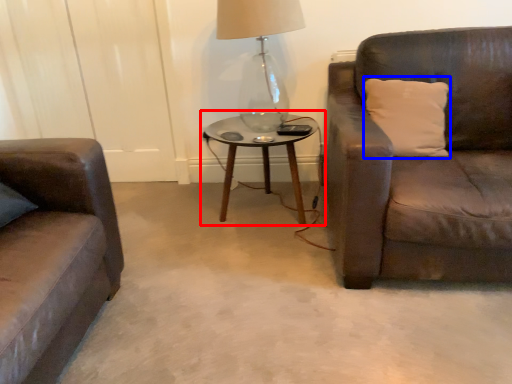
Question: Which object appears farthest to the camera in this image, coffee table (highlighted by a red box) or pillow (highlighted by a blue box)?

Choices:
 (A) coffee table
 (B) pillow

Answer: (A)